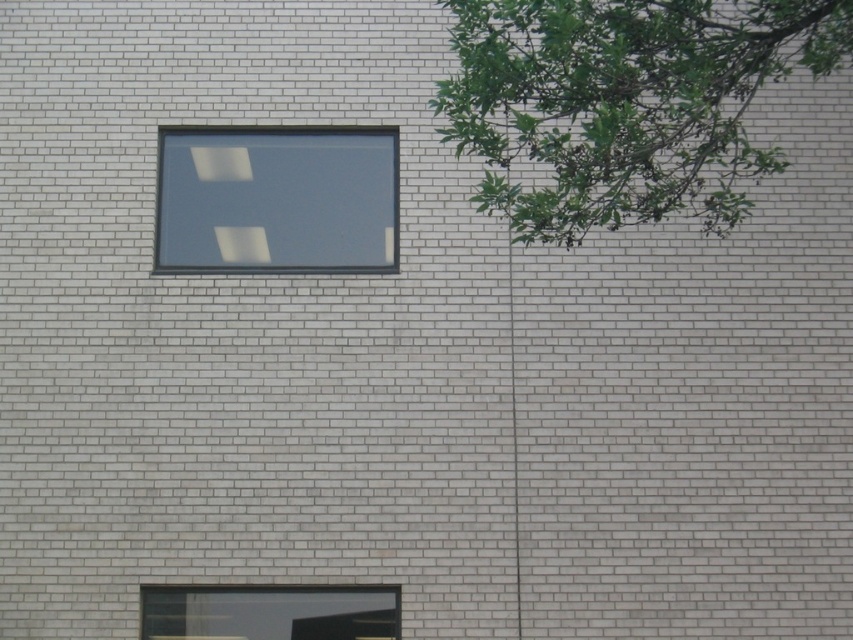
You are standing in front of a building with a light gray brick wall. There is a rectangular window slightly off to the upper left and a tree branch to the right of the window. You want to place a small statue exactly at the point labeled point (312, 212). If the statue is 2 meters tall, will it be visible from your current position?

The point (312, 212) is 10.18 meters away from the camera. Since the statue is only 2 meters tall, it may not be visible from this distance due to its small size relative to the distance. However, visibility also depends on factors like lighting and obstruction, which are not specified here.

You are an architect reviewing a building design. The building has two windows, the transparent glass window at upper center and the transparent glass window at lower center. Which window has a larger height?

The transparent glass window at upper center has a greater height compared to the transparent glass window at lower center, so the window at upper center is larger in height.